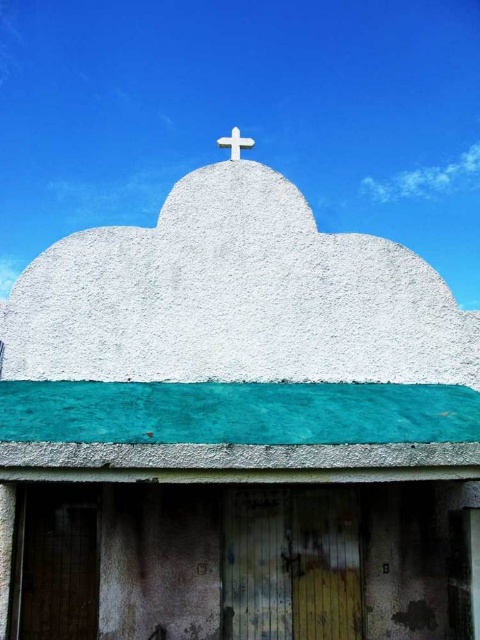
Looking at the church building, where is the white rough concrete cloud at upper left in relation to the white stone cross at upper center?

The white rough concrete cloud at upper left is to the left of the white stone cross at upper center.

You are standing in front of the church building and want to know if the white rough concrete cloud at upper left is nearer to you than the white stone cross at upper center. Can you determine this based on the structure?

The white rough concrete cloud at upper left is closer to the viewer than the white stone cross at upper center, so yes, it is nearer.